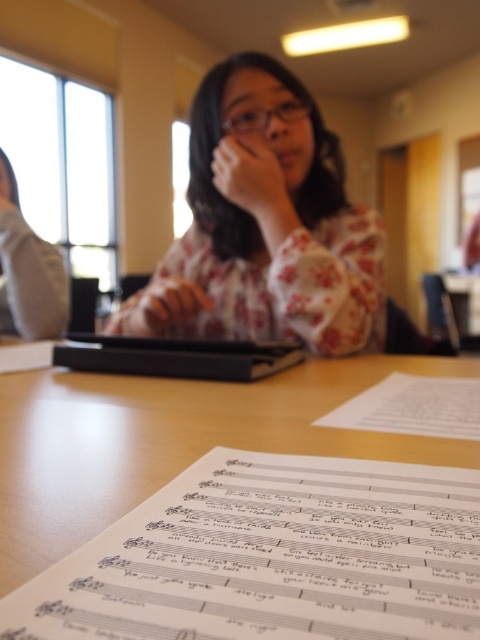
You are a student who needs to reach the white paper at center from your current position near the gray fabric shirt at left. Can you comfortably extend your arm to grab it without moving your body?

The distance between the gray fabric shirt at left and the white paper at center is 38.67 inches. Since the average human arm length is about 28 inches, you would need to stretch further than your arm length to reach the white paper at center from the gray fabric shirt at left.

You are standing in the classroom and want to pick up an object from the table. The point where you need to reach is located at coordinates point [425,456]. If your hand can extend 18 inches forward, will you be able to reach that point?

The point [425,456] is 17.93 inches away from the camera. Since your hand can extend 18 inches forward, you can reach the point [425,456] as it is within your reach.